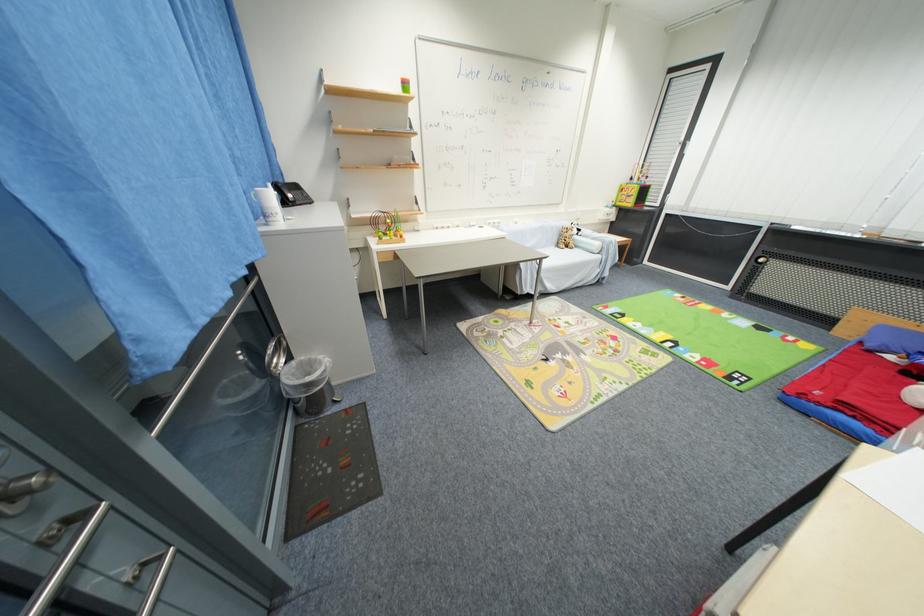
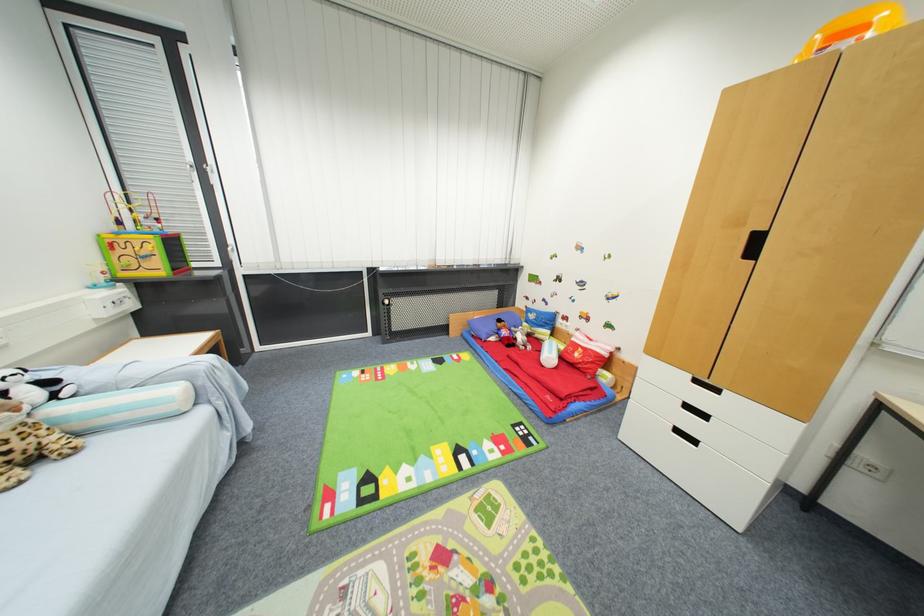
Find the pixel in the second image that matches (569,244) in the first image.

(7, 456)